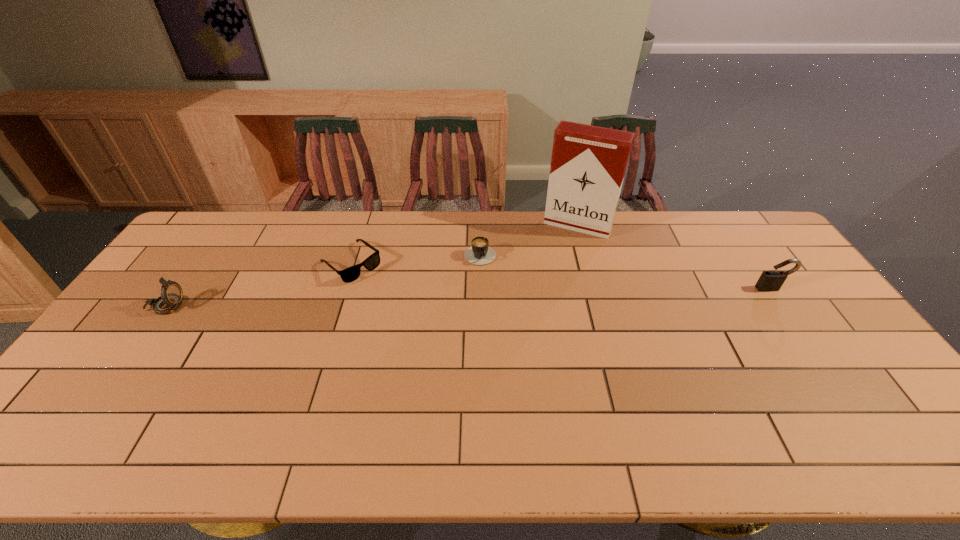
The image size is (960, 540). Find the location of `vacant space positioned on the front-facing side of the fourth object from left to right`. vacant space positioned on the front-facing side of the fourth object from left to right is located at coordinates (536, 309).

Find the location of `vacant point located 0.240m on the front-facing side of the fourth object from left to right`. vacant point located 0.240m on the front-facing side of the fourth object from left to right is located at coordinates (548, 281).

Find the location of `vacant space positioned 0.070m on the front-facing side of the second object from left to right`. vacant space positioned 0.070m on the front-facing side of the second object from left to right is located at coordinates (382, 290).

Where is `free space located 0.290m on the front-facing side of the second object from left to right`? The image size is (960, 540). free space located 0.290m on the front-facing side of the second object from left to right is located at coordinates (428, 328).

I want to click on vacant region located on the front-facing side of the second object from left to right, so click(x=402, y=307).

I want to click on blank area located 0.190m with the handle on the side of the third object from left to right, so click(x=499, y=307).

Identify the location of free spot located 0.200m with the handle on the side of the third object from left to right. The height and width of the screenshot is (540, 960). (500, 309).

The width and height of the screenshot is (960, 540). In order to click on free region located 0.140m with the handle on the side of the third object from left to right in this screenshot , I will do `click(495, 295)`.

Identify the location of cigarette_case present at the far edge. This screenshot has width=960, height=540. (588, 163).

Where is `sunglasses that is at the far edge`? sunglasses that is at the far edge is located at coordinates (350, 274).